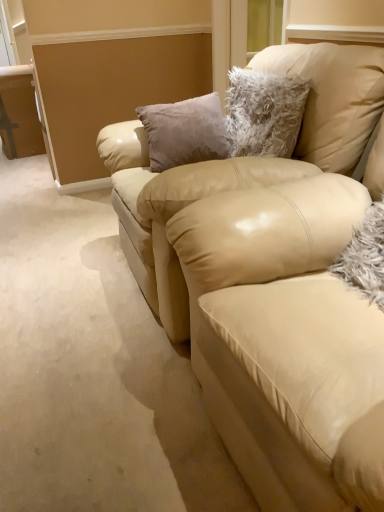
Measure the distance between point (218, 211) and camera.

Point (218, 211) and camera are 1.12 meters apart from each other.

Where is `satin beige couch at center`? The width and height of the screenshot is (384, 512). satin beige couch at center is located at coordinates (273, 284).

This screenshot has width=384, height=512. What do you see at coordinates (273, 284) in the screenshot?
I see `satin beige couch at center` at bounding box center [273, 284].

Identify the location of satin beige couch at center. (273, 284).